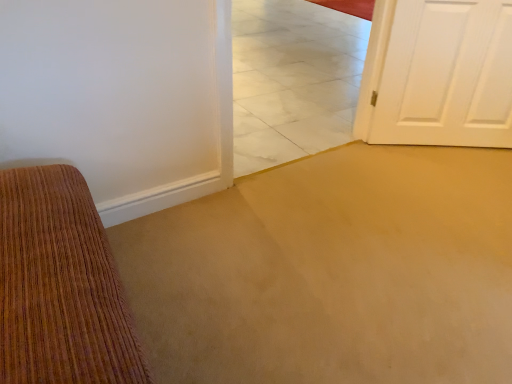
Question: Is white marble tile at center to the right of white painted wood door at right from the viewer's perspective?

Choices:
 (A) yes
 (B) no

Answer: (B)

Question: Can you confirm if white marble tile at center is shorter than white painted wood door at right?

Choices:
 (A) no
 (B) yes

Answer: (A)

Question: Is white marble tile at center behind white painted wood door at right?

Choices:
 (A) yes
 (B) no

Answer: (B)

Question: Is white marble tile at center looking in the opposite direction of white painted wood door at right?

Choices:
 (A) yes
 (B) no

Answer: (B)

Question: From the image's perspective, is white marble tile at center located above white painted wood door at right?

Choices:
 (A) yes
 (B) no

Answer: (B)

Question: Is white marble tile at center positioned beyond the bounds of white painted wood door at right?

Choices:
 (A) no
 (B) yes

Answer: (B)

Question: From the image's perspective, is white painted wood door at right located beneath white marble tile at center?

Choices:
 (A) no
 (B) yes

Answer: (A)

Question: Is white painted wood door at right oriented away from white marble tile at center?

Choices:
 (A) yes
 (B) no

Answer: (B)

Question: Is white painted wood door at right located outside white marble tile at center?

Choices:
 (A) yes
 (B) no

Answer: (A)

Question: From a real-world perspective, is white painted wood door at right physically below white marble tile at center?

Choices:
 (A) no
 (B) yes

Answer: (B)

Question: Could you tell me if white painted wood door at right is turned towards white marble tile at center?

Choices:
 (A) yes
 (B) no

Answer: (B)

Question: Is white painted wood door at right shorter than white marble tile at center?

Choices:
 (A) no
 (B) yes

Answer: (B)

Question: From the image's perspective, is white painted wood door at right above or below white marble tile at center?

Choices:
 (A) below
 (B) above

Answer: (B)